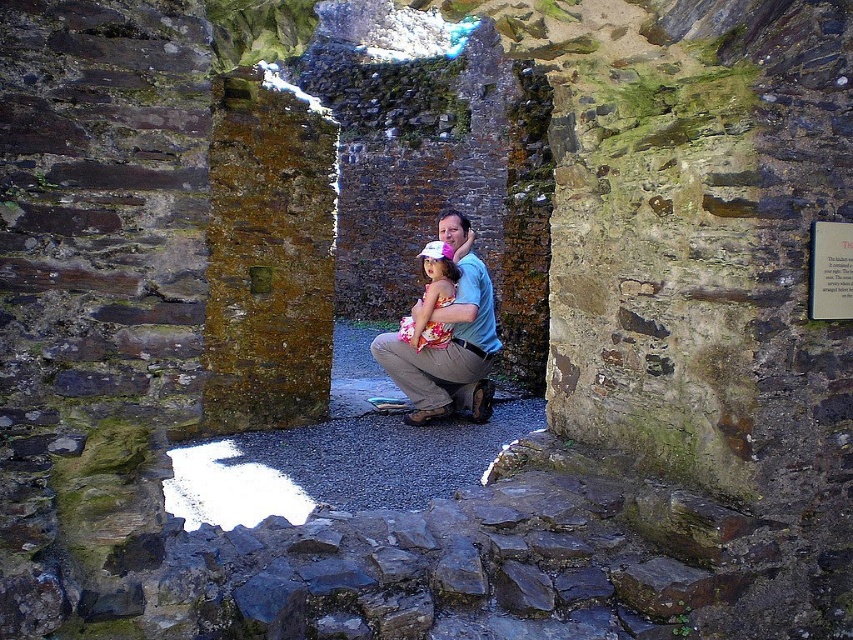
Question: Which point is closer to the camera taking this photo?

Choices:
 (A) (486, 355)
 (B) (427, 266)

Answer: (B)

Question: Which point is farther to the camera?

Choices:
 (A) (456, 278)
 (B) (426, 404)

Answer: (B)

Question: Is matte blue shirt at center closer to camera compared to floral dress at center?

Choices:
 (A) yes
 (B) no

Answer: (A)

Question: Is matte blue shirt at center to the left of floral dress at center from the viewer's perspective?

Choices:
 (A) no
 (B) yes

Answer: (A)

Question: Which object is closer to the camera taking this photo?

Choices:
 (A) floral dress at center
 (B) matte blue shirt at center

Answer: (B)

Question: Does matte blue shirt at center appear over floral dress at center?

Choices:
 (A) no
 (B) yes

Answer: (A)